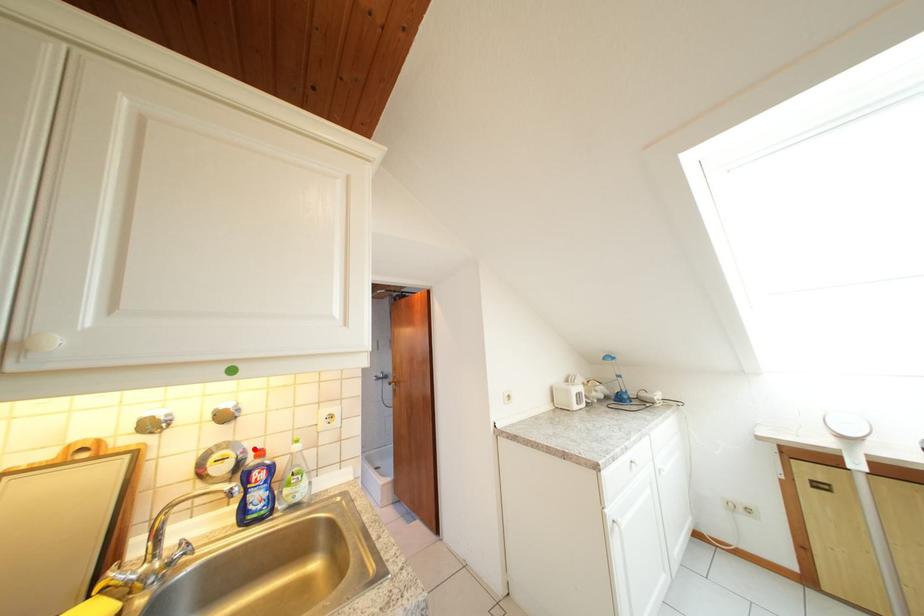
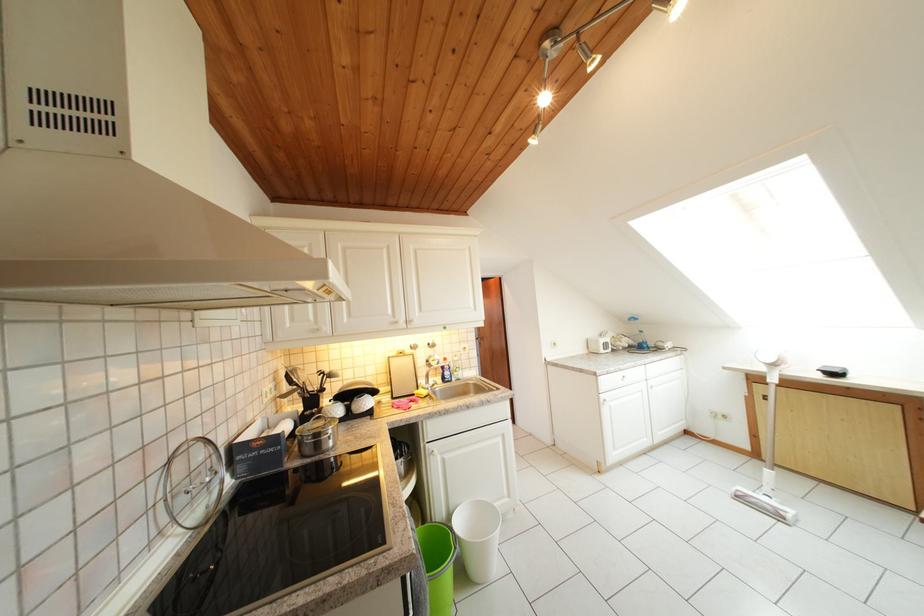
In the second image, find the point that corresponds to the highlighted location in the first image.

(445, 362)